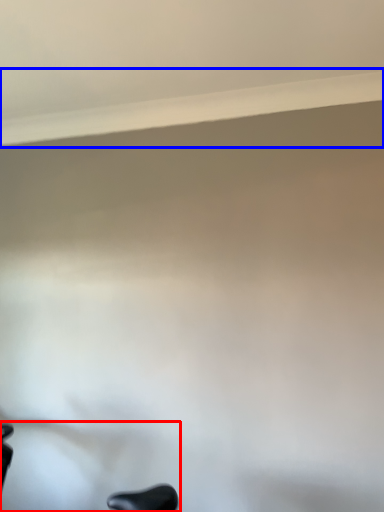
Question: Which point is further to the camera, swivel chair (highlighted by a red box) or window sill (highlighted by a blue box)?

Choices:
 (A) swivel chair
 (B) window sill

Answer: (B)